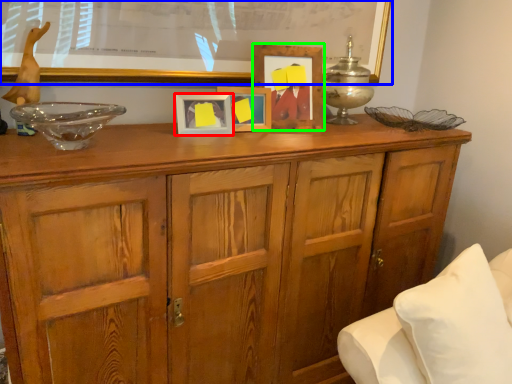
Question: Estimate the real-world distances between objects in this image. Which object is farther from picture frame (highlighted by a red box), bulletin board (highlighted by a blue box) or picture frame (highlighted by a green box)?

Choices:
 (A) bulletin board
 (B) picture frame

Answer: (A)